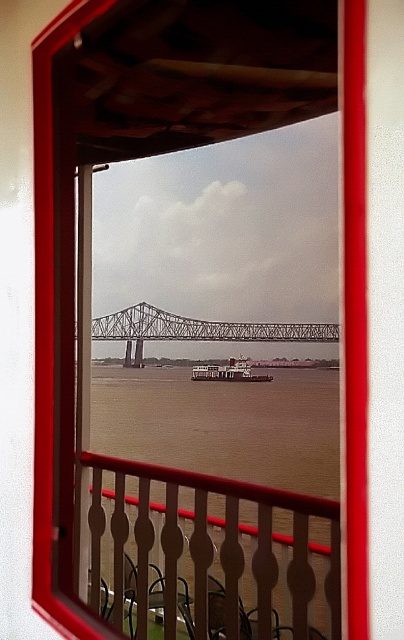
Question: Which point is closer to the camera taking this photo?

Choices:
 (A) [252, 330]
 (B) [246, 380]

Answer: (B)

Question: Is brown wood railing at center below white matte barge at center?

Choices:
 (A) no
 (B) yes

Answer: (B)

Question: Which point is farther to the camera?

Choices:
 (A) metallic gray bridge at center
 (B) brown wood railing at center
 (C) white matte barge at center

Answer: (A)

Question: Does brown wood railing at center have a lesser width compared to white matte barge at center?

Choices:
 (A) yes
 (B) no

Answer: (B)

Question: Does metallic gray bridge at center appear on the right side of white matte barge at center?

Choices:
 (A) no
 (B) yes

Answer: (A)

Question: Which is farther from the metallic gray bridge at center?

Choices:
 (A) white matte barge at center
 (B) brown wood railing at center

Answer: (B)